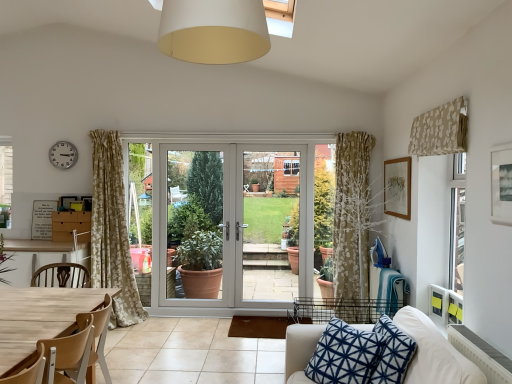
The width and height of the screenshot is (512, 384). What do you see at coordinates (214, 31) in the screenshot?
I see `white matte lampshade at upper center` at bounding box center [214, 31].

Where is `wooden picture frame at upper right, which is counted as the 1th picture frame, starting from the back`? The width and height of the screenshot is (512, 384). wooden picture frame at upper right, which is counted as the 1th picture frame, starting from the back is located at coordinates (397, 187).

In order to face wooden picture frame at upper right, acting as the 2th picture frame starting from the left, should I rotate leftwards or rightwards?

A 18.156 degree turn to the right will do.

The height and width of the screenshot is (384, 512). Describe the element at coordinates (195, 221) in the screenshot. I see `matte white screen door at center, arranged as the 3th screen door when viewed from the right` at that location.

At what (x,y) coordinates should I click in order to perform the action: click on blue printed cushion at lower right. Please return your answer as a coordinate pair (x, y). The image size is (512, 384). Looking at the image, I should click on (345, 355).

In the scene shown: How much space does matte black picture frame at upper right, which appears as the second picture frame when viewed from the right, occupy vertically?

matte black picture frame at upper right, which appears as the second picture frame when viewed from the right, is 16.19 inches in height.

What do you see at coordinates (271, 223) in the screenshot?
I see `white glossy door at center, which appears as the 1th screen door when viewed from the right` at bounding box center [271, 223].

Image resolution: width=512 pixels, height=384 pixels. I want to click on white fabric couch at lower right, so click(x=434, y=353).

Describe the element at coordinates (63, 155) in the screenshot. I see `white plastic clock at upper left` at that location.

Where is `white matte lampshade at upper center`? Image resolution: width=512 pixels, height=384 pixels. white matte lampshade at upper center is located at coordinates (214, 31).

Considering the sizes of blue printed cushion at lower right and white matte lampshade at upper center in the image, is blue printed cushion at lower right taller or shorter than white matte lampshade at upper center?

In the image, blue printed cushion at lower right appears to be taller than white matte lampshade at upper center.

Considering the positions of point (320, 359) and point (199, 11), is point (320, 359) closer or farther from the camera than point (199, 11)?

Point (320, 359) is farther from the camera than point (199, 11).

The height and width of the screenshot is (384, 512). There is a blue printed cushion at lower right. In order to click on light fixture above it (from a real-world perspective) in this screenshot , I will do `click(214, 31)`.

Is beige floral fabric at upper right turned away from wooden picture frame at upper right, the 1th picture frame positioned from the right?

No, beige floral fabric at upper right's orientation is not away from wooden picture frame at upper right, the 1th picture frame positioned from the right.

Measure the distance from beige floral fabric at upper right to wooden picture frame at upper right, the 1th picture frame positioned from the right.

beige floral fabric at upper right and wooden picture frame at upper right, the 1th picture frame positioned from the right, are 25.33 inches apart from each other.

Can wooden picture frame at upper right, acting as the 2th picture frame starting from the left, be found inside beige floral fabric at upper right?

No, beige floral fabric at upper right does not contain wooden picture frame at upper right, acting as the 2th picture frame starting from the left.

Does clear glass door at center, positioned as the 2th screen door in left-to-right order, have a smaller size compared to white glossy door at center, which appears as the 1th screen door when viewed from the right?

No, clear glass door at center, positioned as the 2th screen door in left-to-right order, is not smaller than white glossy door at center, which appears as the 1th screen door when viewed from the right.

You are a GUI agent. You are given a task and a screenshot of the screen. Output one action in this format:
    pyautogui.click(x=<x>, y=<y>)
    Task: Click on the screen door located in front of the clear glass door at center, positioned as the 2th screen door in left-to-right order
    
    Given the screenshot: What is the action you would take?
    pyautogui.click(x=271, y=223)

Consider the image. Which point is more forward, (221, 258) or (260, 256)?

Point (221, 258)

Which of these two, clear glass door at center, positioned as the 2th screen door in left-to-right order, or white glossy door at center, which appears as the 1th screen door when viewed from the right, stands shorter?

Standing shorter between the two is clear glass door at center, positioned as the 2th screen door in left-to-right order.

The image size is (512, 384). Identify the location of cabinetry behind the light brown wood chair at lower left. tap(71, 225).

From a real-world perspective, is brown matte cabinet at left under light brown wood chair at lower left?

No, from a real-world perspective, brown matte cabinet at left is not under light brown wood chair at lower left.

Is brown matte cabinet at left situated inside light brown wood chair at lower left or outside?

brown matte cabinet at left cannot be found inside light brown wood chair at lower left.

From the image's perspective, is brown matte cabinet at left above light brown wood chair at lower left?

Yes, from the image's perspective, brown matte cabinet at left is above light brown wood chair at lower left.

Does matte black picture frame at upper right, which appears as the second picture frame when viewed from the right, turn towards beige floral fabric at upper right?

No, matte black picture frame at upper right, which appears as the second picture frame when viewed from the right, is not facing towards beige floral fabric at upper right.

Looking at their sizes, would you say matte black picture frame at upper right, acting as the 2th picture frame starting from the back, is wider or thinner than beige floral fabric at upper right?

Clearly, matte black picture frame at upper right, acting as the 2th picture frame starting from the back, has less width compared to beige floral fabric at upper right.

Consider the image. Which point is more forward, (507, 203) or (445, 117)?

Point (507, 203)

Are beige floral fabric at upper right and light brown wood chair at lower left located far from each other?

Indeed, beige floral fabric at upper right is not near light brown wood chair at lower left.

Choose the correct answer: Is beige floral fabric at upper right inside light brown wood chair at lower left or outside it?

beige floral fabric at upper right exists outside the volume of light brown wood chair at lower left.

Who is bigger, beige floral fabric at upper right or light brown wood chair at lower left?

light brown wood chair at lower left.

Could you tell me if beige floral fabric at upper right is turned towards light brown wood chair at lower left?

No, beige floral fabric at upper right is not turned towards light brown wood chair at lower left.

Looking at this image, in terms of height, does white fabric couch at lower right look taller or shorter compared to white matte lampshade at upper center?

white fabric couch at lower right is taller than white matte lampshade at upper center.

Considering the relative sizes of white fabric couch at lower right and white matte lampshade at upper center in the image provided, is white fabric couch at lower right smaller than white matte lampshade at upper center?

Incorrect, white fabric couch at lower right is not smaller in size than white matte lampshade at upper center.

Is white fabric couch at lower right looking in the opposite direction of white matte lampshade at upper center?

No, white matte lampshade at upper center is not at the back of white fabric couch at lower right.

Is white fabric couch at lower right at the left side of white matte lampshade at upper center?

Incorrect, white fabric couch at lower right is not on the left side of white matte lampshade at upper center.

Locate an element on the screen. light fixture that is above the blue printed cushion at lower right (from a real-world perspective) is located at coordinates (214, 31).

Identify the location of picture frame behind the beige floral fabric at upper right. The width and height of the screenshot is (512, 384). (397, 187).

When comparing their distances from white fabric couch at lower right, does blue printed cushion at lower right or matte white screen door at center, which is the 1th screen door in left-to-right order, seem further?

matte white screen door at center, which is the 1th screen door in left-to-right order.

From the picture: From the image, which object appears to be farther from brown matte cabinet at left, white plastic clock at upper left or white matte lampshade at upper center?

The object further to brown matte cabinet at left is white matte lampshade at upper center.

When comparing their distances from white matte lampshade at upper center, does white glossy door at center, marked as the 3th screen door in a left-to-right arrangement, or matte black picture frame at upper right, which ranks as the 1th picture frame in left-to-right order, seem closer?

matte black picture frame at upper right, which ranks as the 1th picture frame in left-to-right order.

When comparing their distances from wooden picture frame at upper right, acting as the 2th picture frame starting from the left, does white fabric couch at lower right or white glossy door at center, which appears as the 1th screen door when viewed from the right, seem further?

The object further to wooden picture frame at upper right, acting as the 2th picture frame starting from the left, is white fabric couch at lower right.

Looking at the image, which one is located further to matte black picture frame at upper right, which ranks as the 1th picture frame in left-to-right order, white plastic clock at upper left or white matte lampshade at upper center?

Based on the image, white plastic clock at upper left appears to be further to matte black picture frame at upper right, which ranks as the 1th picture frame in left-to-right order.

When comparing their distances from blue printed cushion at lower right, does white matte lampshade at upper center or clear glass door at center, the second screen door when ordered from right to left, seem closer?

white matte lampshade at upper center is positioned closer to the anchor blue printed cushion at lower right.

When comparing their distances from clear glass door at center, positioned as the 2th screen door in left-to-right order, does light brown wood chair at lower left or white plastic clock at upper left seem further?

Based on the image, light brown wood chair at lower left appears to be further to clear glass door at center, positioned as the 2th screen door in left-to-right order.

Estimate the real-world distances between objects in this image. Which object is further from matte white screen door at center, which is the 1th screen door in left-to-right order, white plastic clock at upper left or clear glass door at center, the second screen door when ordered from right to left?

white plastic clock at upper left is further to matte white screen door at center, which is the 1th screen door in left-to-right order.

This screenshot has height=384, width=512. I want to click on chair between white fabric couch at lower right and clear glass door at center, positioned as the 2th screen door in left-to-right order, in the front-back direction, so click(68, 354).

You are a GUI agent. You are given a task and a screenshot of the screen. Output one action in this format:
    pyautogui.click(x=<x>, y=<y>)
    Task: Click on the pillow between matte black picture frame at upper right, which ranks as the 1th picture frame in left-to-right order, and white fabric couch at lower right in the up-down direction
    
    Given the screenshot: What is the action you would take?
    pyautogui.click(x=345, y=355)

This screenshot has height=384, width=512. What are the coordinates of `picture frame between white matte lampshade at upper center and beige floral fabric at upper right from left to right` in the screenshot? It's located at (501, 184).

You are a GUI agent. You are given a task and a screenshot of the screen. Output one action in this format:
    pyautogui.click(x=<x>, y=<y>)
    Task: Click on the clock positioned between white matte lampshade at upper center and clear glass door at center, positioned as the 2th screen door in left-to-right order, from near to far
    The width and height of the screenshot is (512, 384).
    Given the screenshot: What is the action you would take?
    [63, 155]